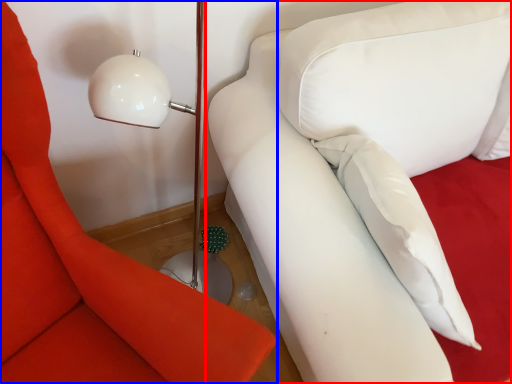
Question: Which of the following is the farthest to the observer, studio couch (highlighted by a red box) or furniture (highlighted by a blue box)?

Choices:
 (A) studio couch
 (B) furniture

Answer: (A)